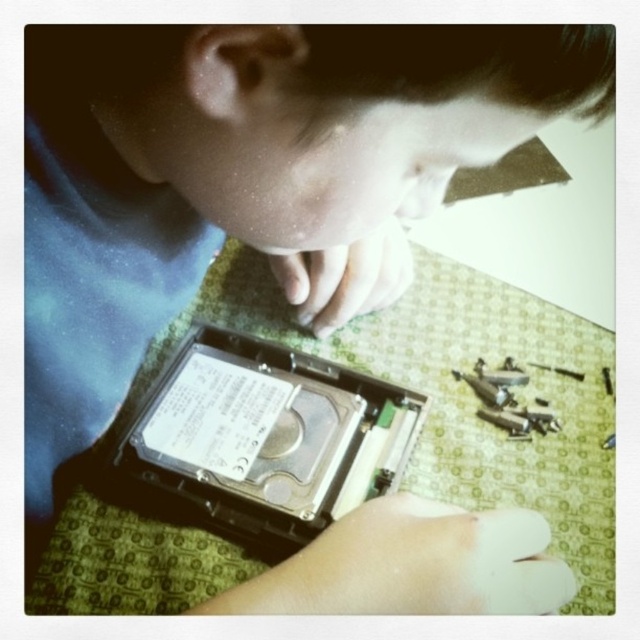
Between white matte hand at lower center and matte black hard drive at center, which one appears on the right side from the viewer's perspective?

white matte hand at lower center

How much distance is there between white matte hand at lower center and matte black hard drive at center?

white matte hand at lower center is 7.24 inches away from matte black hard drive at center.

Which is in front, point (467, 557) or point (392, 250)?

Point (467, 557) is more forward.

The width and height of the screenshot is (640, 640). I want to click on white matte hand at lower center, so click(x=412, y=564).